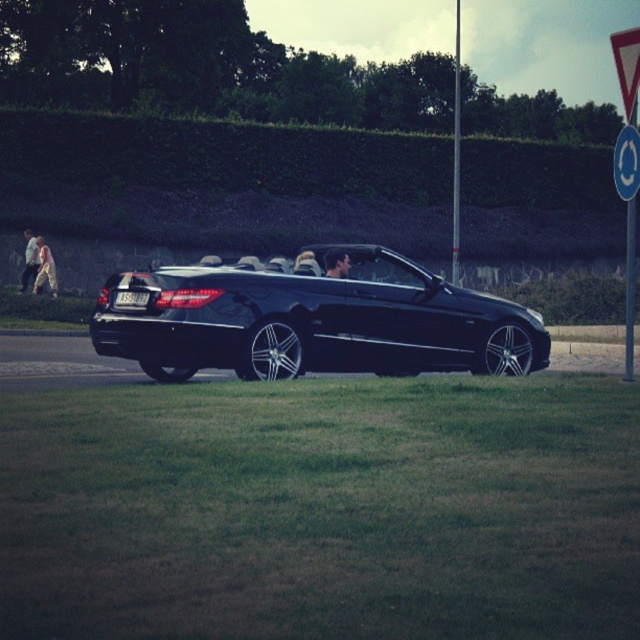
Who is more forward, (24, 276) or (332, 260)?

Positioned in front is point (332, 260).

Does point (22, 285) come in front of point (340, 272)?

No, it is behind (340, 272).

What do you see at coordinates (29, 260) in the screenshot? I see `light beige fabric pants at left` at bounding box center [29, 260].

At what (x,y) coordinates should I click in order to perform the action: click on light beige fabric pants at left. Please return your answer as a coordinate pair (x, y). Looking at the image, I should click on (29, 260).

Can you confirm if smooth leather jacket at center is positioned to the right of black plastic license plate at center?

Indeed, smooth leather jacket at center is positioned on the right side of black plastic license plate at center.

What do you see at coordinates (337, 262) in the screenshot?
I see `smooth leather jacket at center` at bounding box center [337, 262].

Locate an element on the screen. smooth leather jacket at center is located at coordinates (337, 262).

Does blue circular sign at upper right come in front of black plastic license plate at center?

That is True.

Does point (618, 134) come farther from viewer compared to point (116, 294)?

Yes, it is.

Identify the location of blue circular sign at upper right. [x=627, y=163].